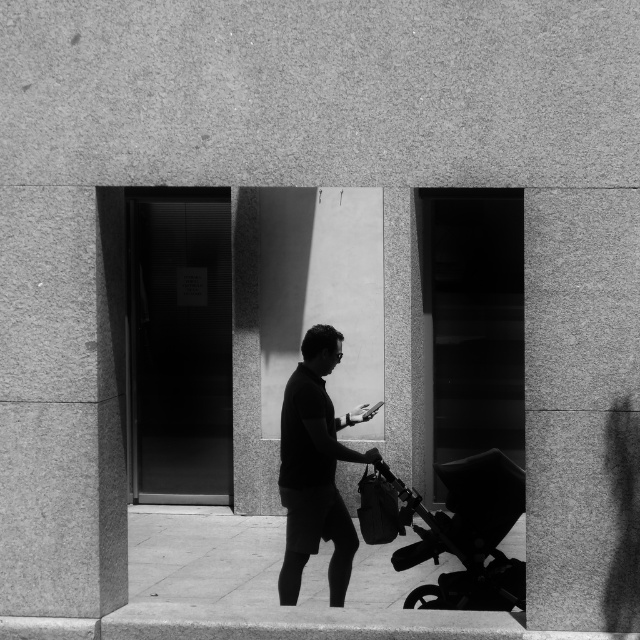
You are a photographer trying to capture a candid shot of the dark gray fabric shirt at center and the black plastic baby carriage at lower right. Since you want both subjects to be clearly visible in the frame, which object should you focus on to ensure proper depth of field?

The dark gray fabric shirt at center should be focused on because it is larger than the black plastic baby carriage at lower right, so focusing on the larger object will help ensure both are in focus.

You are a delivery robot that needs to place a package on the smooth concrete pavement at center. However, there is a black plastic baby carriage at lower right in the way. Can you place the package on the pavement without moving the carriage?

The smooth concrete pavement at center is positioned under the black plastic baby carriage at lower right, so the carriage is blocking access to the pavement. You cannot place the package there without moving the carriage.